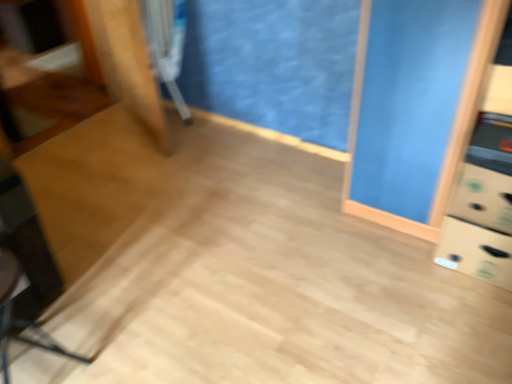
You are a GUI agent. You are given a task and a screenshot of the screen. Output one action in this format:
    pyautogui.click(x=<x>, y=<y>)
    Task: Click on the free location in front of metallic silver swivel chair at upper left, acting as the 2th swivel chair starting from the front
    The width and height of the screenshot is (512, 384).
    Given the screenshot: What is the action you would take?
    pyautogui.click(x=187, y=132)